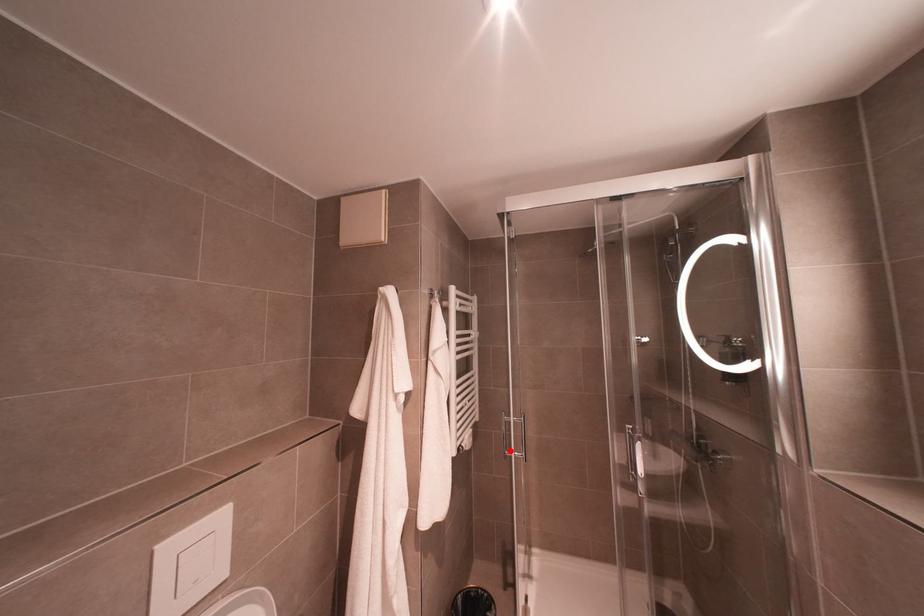
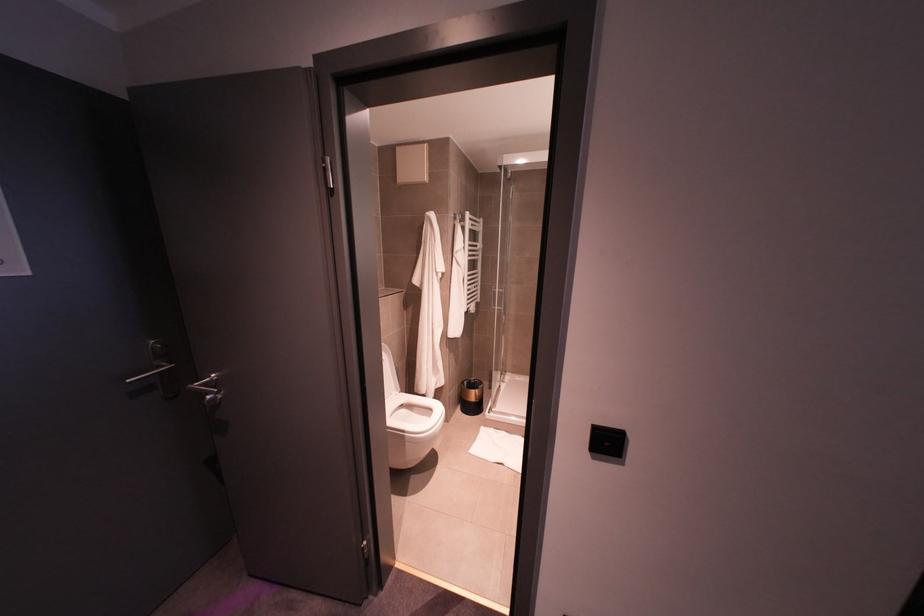
Find the pixel in the second image that matches the highlighted location in the first image.

(494, 305)